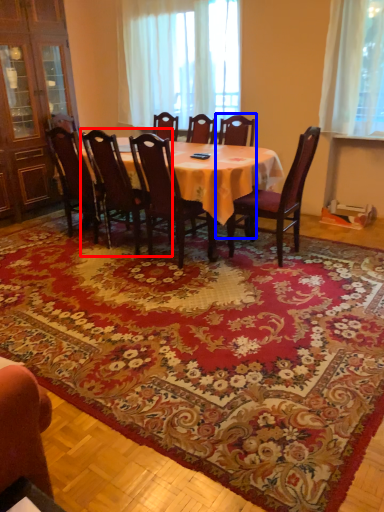
Question: Among these objects, which one is farthest to the camera, chair (highlighted by a red box) or chair (highlighted by a blue box)?

Choices:
 (A) chair
 (B) chair

Answer: (B)